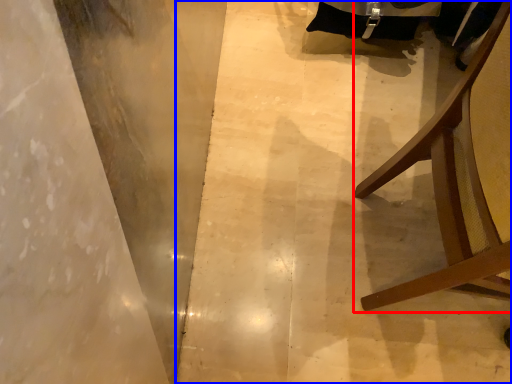
Question: Which point is further to the camera, furniture (highlighted by a red box) or concrete (highlighted by a blue box)?

Choices:
 (A) furniture
 (B) concrete

Answer: (B)